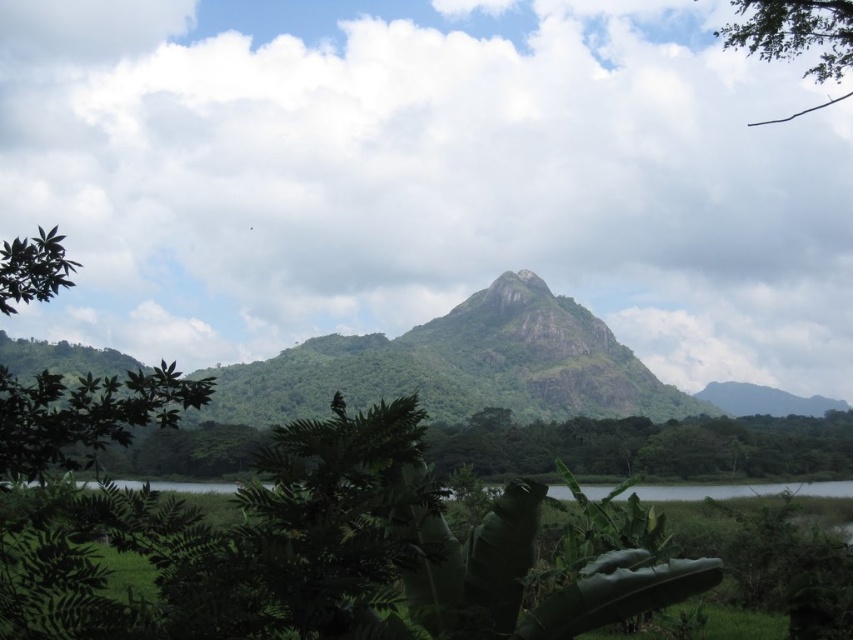
Question: Observing the image, what is the correct spatial positioning of green textured mountain at center in reference to green leafy tree at left?

Choices:
 (A) left
 (B) right

Answer: (B)

Question: Which object is the closest to the green leafy tree at left?

Choices:
 (A) green textured mountain at center
 (B) green leafy branch at upper right

Answer: (A)

Question: Estimate the real-world distances between objects in this image. Which object is farther from the green leafy tree at upper left?

Choices:
 (A) green leafy water at lower center
 (B) green leafy tree at left
 (C) green textured mountain at center

Answer: (C)

Question: Is green textured mountain at center to the left of green leafy tree at left from the viewer's perspective?

Choices:
 (A) yes
 (B) no

Answer: (B)

Question: Among these points, which one is farthest from the camera?

Choices:
 (A) (50, 230)
 (B) (746, 44)
 (C) (650, 500)
 (D) (16, 257)

Answer: (C)

Question: Is green leafy tree at left wider than green leafy tree at upper left?

Choices:
 (A) yes
 (B) no

Answer: (A)